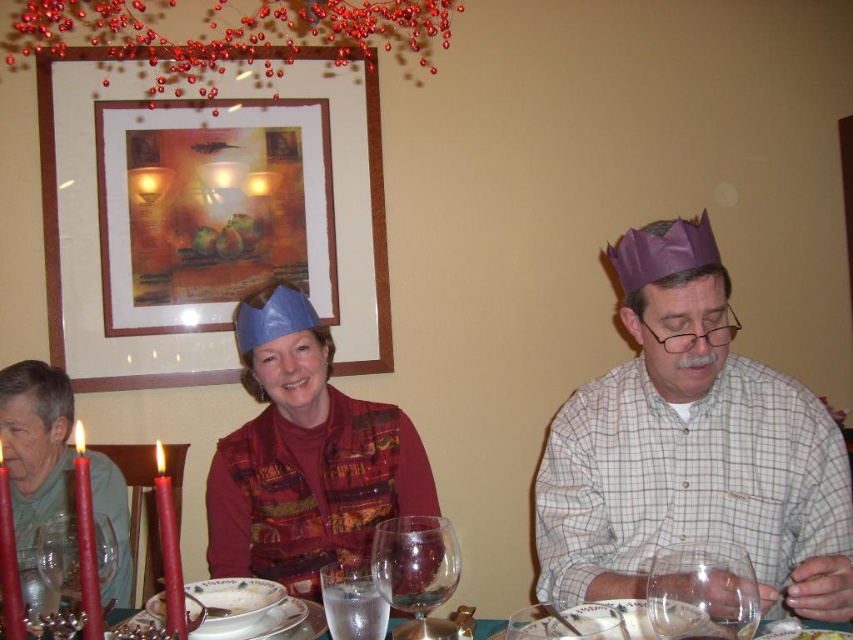
You are standing in the dining area and want to place a small decoration between the two points labeled as point (672, 525) and point (328, 499). Since you want the decoration to be closer to the viewer, which point should you position it near?

You should position the decoration near point (672, 525) because it is closer to the viewer compared to point (328, 499).

In the festive dining scene, there are three people seated around a table with red candles and glasses. You notice a point labeled at coordinates (305,456). What object is located at that point?

The point at coordinates (305,456) indicates the location of the matte blue paper crown at center.

You are a guest at this holiday dinner and notice two paper crowns on the table. Which one is positioned more to the right between the purple paper crown at right and the matte blue paper crown at center?

The purple paper crown at right is positioned more to the right than the matte blue paper crown at center.